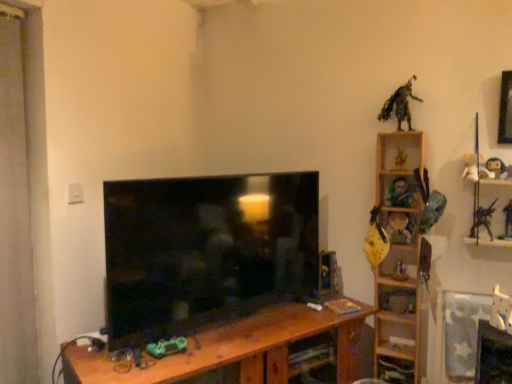
The image size is (512, 384). Find the location of `free space between matte black tv at center and green matte toy car at center, which is the 1th toy from left to right`. free space between matte black tv at center and green matte toy car at center, which is the 1th toy from left to right is located at coordinates 226,333.